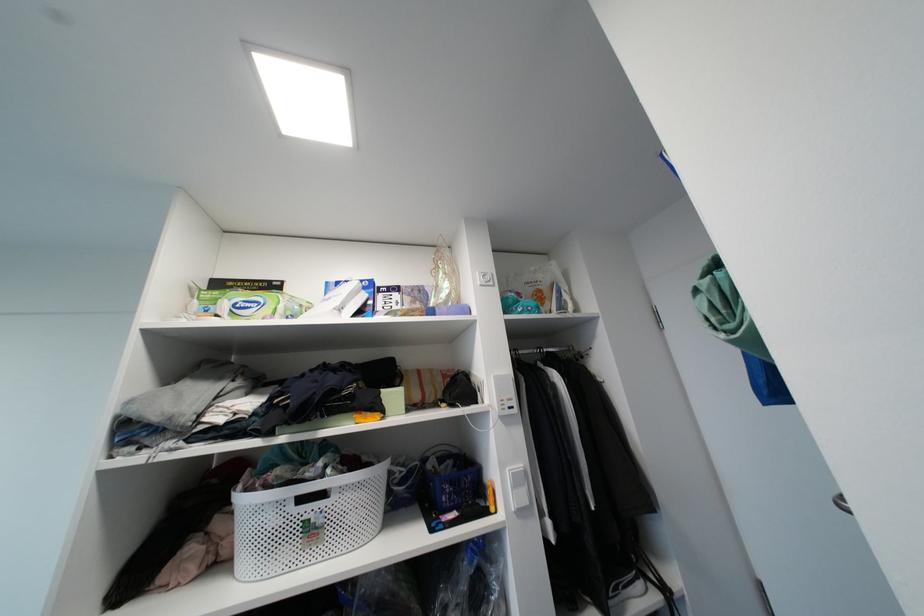
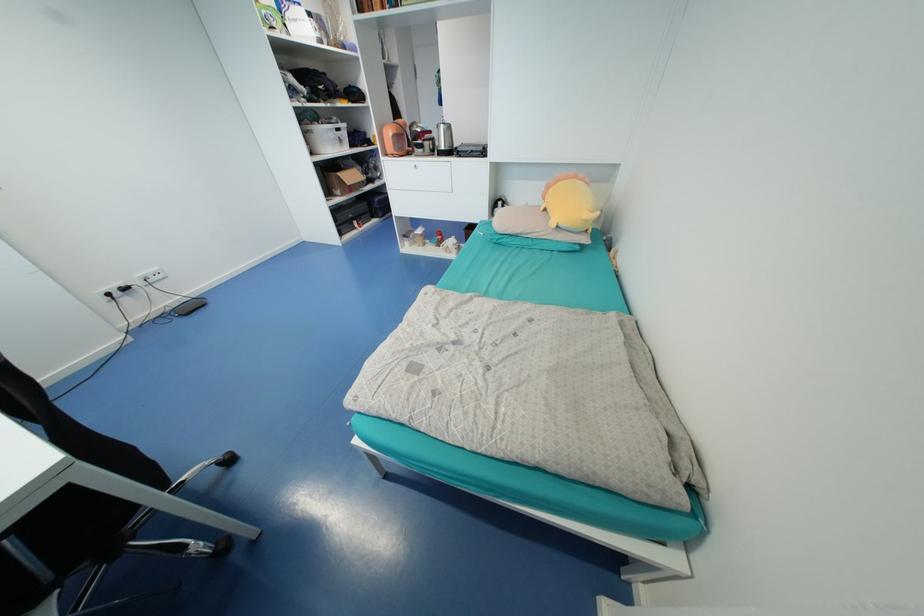
Question: I am providing you with two images of the same scene from different viewpoints. After the viewpoint changes to image2, which objects are now occluded?

Choices:
 (A) white power strip
 (B) cardboard box
 (C) white product box
 (D) green tissue package

Answer: (D)